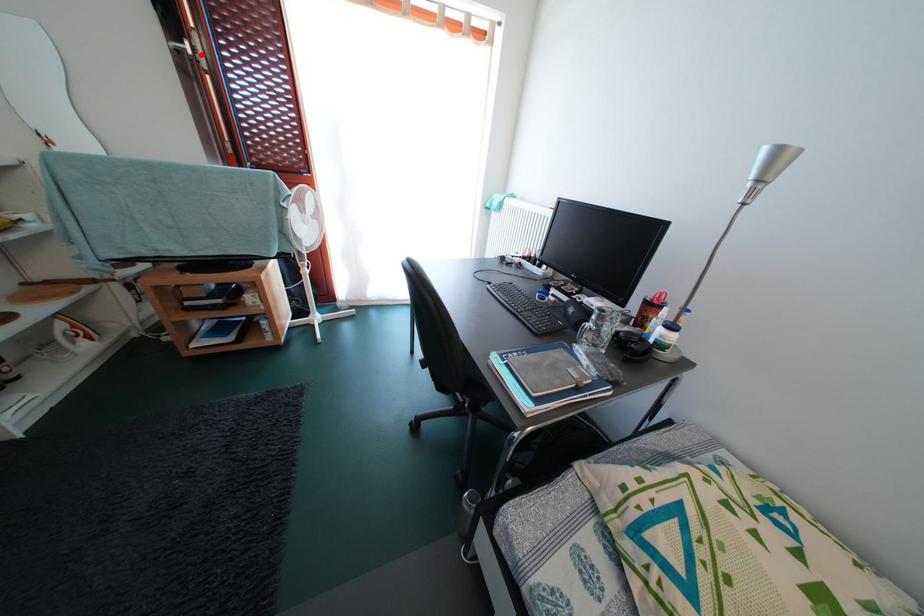
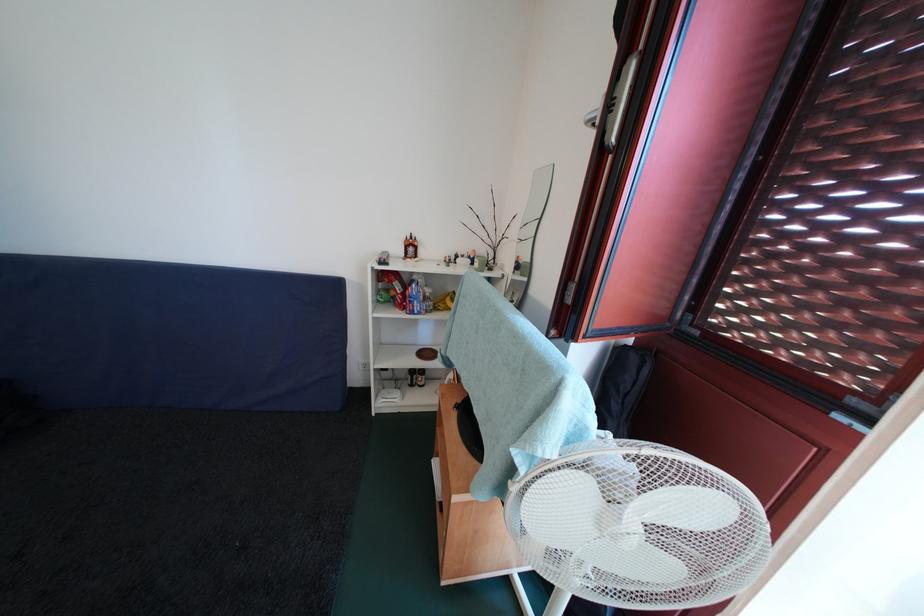
The point at the highlighted location is marked in the first image. Where is the corresponding point in the second image?

(616, 110)